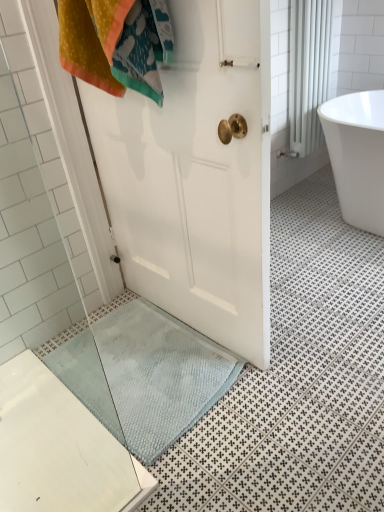
Locate an element on the screen. The width and height of the screenshot is (384, 512). blue textured bath mat at lower center is located at coordinates (143, 376).

Locate an element on the screen. The width and height of the screenshot is (384, 512). white glossy radiator at upper right is located at coordinates (311, 68).

From a real-world perspective, which object stands above the other?

From a 3D spatial view, white glossy radiator at upper right is above.

Considering the sizes of white glossy bathtub at upper right and white glossy radiator at upper right in the image, is white glossy bathtub at upper right taller or shorter than white glossy radiator at upper right?

Clearly, white glossy bathtub at upper right is shorter compared to white glossy radiator at upper right.

Is white glossy bathtub at upper right situated inside white glossy radiator at upper right or outside?

white glossy bathtub at upper right cannot be found inside white glossy radiator at upper right.

Based on the photo, which of these two, white glossy bathtub at upper right or white glossy radiator at upper right, is thinner?

Thinner between the two is white glossy radiator at upper right.

Is the position of blue textured bath mat at lower center more distant than that of white glossy radiator at upper right?

No, it is not.

Which object is positioned more to the right, blue textured bath mat at lower center or white glossy radiator at upper right?

From the viewer's perspective, white glossy radiator at upper right appears more on the right side.

Based on the photo, is blue textured bath mat at lower center bigger than white glossy radiator at upper right?

No.

Are blue textured bath mat at lower center and white glossy radiator at upper right making contact?

No, blue textured bath mat at lower center is not beside white glossy radiator at upper right.

Based on their sizes in the image, would you say white glossy radiator at upper right is bigger or smaller than blue textured bath mat at lower center?

Considering their sizes, white glossy radiator at upper right takes up more space than blue textured bath mat at lower center.

Would you say white glossy radiator at upper right is outside blue textured bath mat at lower center?

Absolutely, white glossy radiator at upper right is external to blue textured bath mat at lower center.

Are white glossy radiator at upper right and blue textured bath mat at lower center making contact?

No, white glossy radiator at upper right is not touching blue textured bath mat at lower center.

From a real-world perspective, relative to blue textured bath mat at lower center, is white glossy radiator at upper right vertically above or below?

white glossy radiator at upper right is above blue textured bath mat at lower center.

Does white glossy bathtub at upper right have a greater height compared to blue textured bath mat at lower center?

Indeed, white glossy bathtub at upper right has a greater height compared to blue textured bath mat at lower center.

Where is `bathtub that appears behind the blue textured bath mat at lower center`? The image size is (384, 512). bathtub that appears behind the blue textured bath mat at lower center is located at coordinates (357, 156).

Does point (363, 218) appear closer or farther from the camera than point (83, 368)?

Point (363, 218) is farther from the camera than point (83, 368).

Can you confirm if white glossy radiator at upper right is shorter than white glossy bathtub at upper right?

Incorrect, the height of white glossy radiator at upper right does not fall short of that of white glossy bathtub at upper right.

Is white glossy radiator at upper right bigger or smaller than white glossy bathtub at upper right?

Clearly, white glossy radiator at upper right is smaller in size than white glossy bathtub at upper right.

Is white glossy radiator at upper right at the left side of white glossy bathtub at upper right?

Yes.

Is blue textured bath mat at lower center oriented away from white glossy bathtub at upper right?

No, blue textured bath mat at lower center is not facing away from white glossy bathtub at upper right.

Is blue textured bath mat at lower center closer to the viewer compared to white glossy bathtub at upper right?

Yes, the depth of blue textured bath mat at lower center is less than that of white glossy bathtub at upper right.

Is point (107, 342) positioned in front of point (344, 131)?

Yes.

How many degrees apart are the facing directions of blue textured bath mat at lower center and white glossy bathtub at upper right?

There is a 91.2-degree angle between the facing directions of blue textured bath mat at lower center and white glossy bathtub at upper right.

Where is `shower curtain above the white glossy bathtub at upper right (from a real-world perspective)`? The height and width of the screenshot is (512, 384). shower curtain above the white glossy bathtub at upper right (from a real-world perspective) is located at coordinates (311, 68).

Locate an element on the screen. The image size is (384, 512). bath mat located in front of the white glossy radiator at upper right is located at coordinates (143, 376).

Based on their spatial positions, is white glossy bathtub at upper right or white glossy radiator at upper right closer to blue textured bath mat at lower center?

white glossy bathtub at upper right lies closer to blue textured bath mat at lower center than the other object.

Estimate the real-world distances between objects in this image. Which object is closer to white glossy radiator at upper right, blue textured bath mat at lower center or white glossy bathtub at upper right?

white glossy bathtub at upper right.

Based on their spatial positions, is white glossy bathtub at upper right or blue textured bath mat at lower center closer to white glossy radiator at upper right?

white glossy bathtub at upper right is positioned closer to the anchor white glossy radiator at upper right.

Looking at the image, which one is located closer to blue textured bath mat at lower center, white glossy radiator at upper right or white glossy bathtub at upper right?

The object closer to blue textured bath mat at lower center is white glossy bathtub at upper right.

From the image, which object appears to be farther from white glossy bathtub at upper right, white glossy radiator at upper right or blue textured bath mat at lower center?

blue textured bath mat at lower center.

Based on their spatial positions, is blue textured bath mat at lower center or white glossy radiator at upper right further from white glossy bathtub at upper right?

blue textured bath mat at lower center is positioned further to the anchor white glossy bathtub at upper right.

Find the location of a particular element. This screenshot has height=512, width=384. bathtub between white glossy radiator at upper right and blue textured bath mat at lower center vertically is located at coordinates (357, 156).